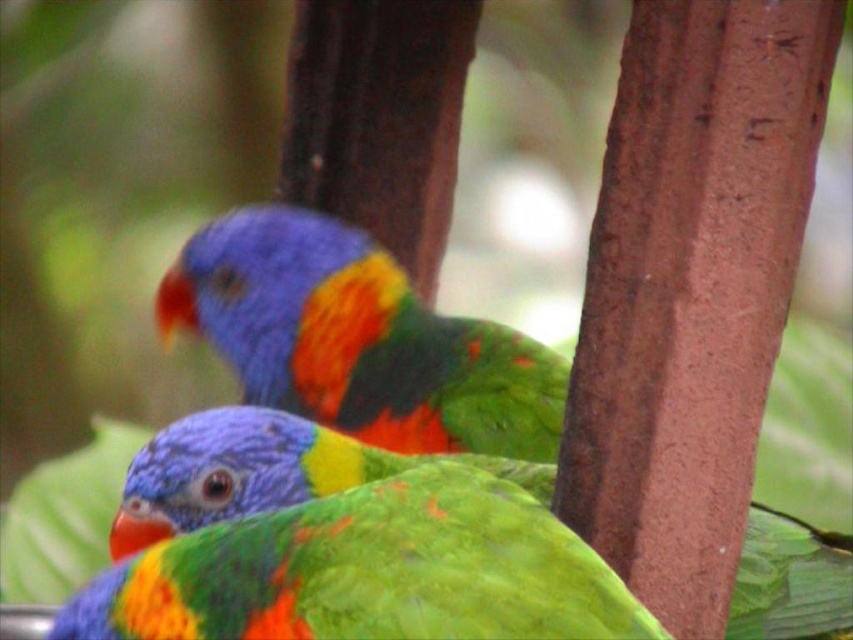
You are a birdwatcher observing two parrots in a forest. You notice a shiny multicolored parrot at center and a shiny green parrot at center. Which parrot is taller?

The shiny multicolored parrot at center is taller than the shiny green parrot at center.

You are a photographer aiming to capture a closeup shot of the shiny multicolored parrot at center. Based on its coordinates, where should you position your camera to ensure it is centered in your viewfinder?

The shiny multicolored parrot at center is located at coordinates point (358, 339), so positioning the camera to center it at those coordinates will ensure the parrot is centered in the viewfinder.

Consider the image. You are a birdwatcher observing two parrots in the center of the image. The scene has a blurred background with green foliage and a tree trunk on the right. Which parrot is positioned to the left side between the two shiny multicolored parrot at center and shiny green parrot at center?

The shiny multicolored parrot at center is positioned to the left of the shiny green parrot at center.